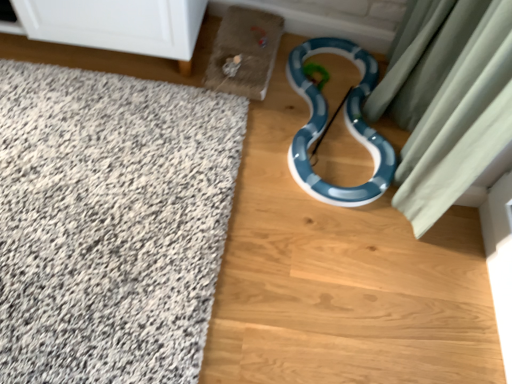
This screenshot has height=384, width=512. I want to click on vacant area that is in front of blue glossy snake at center, so click(x=351, y=276).